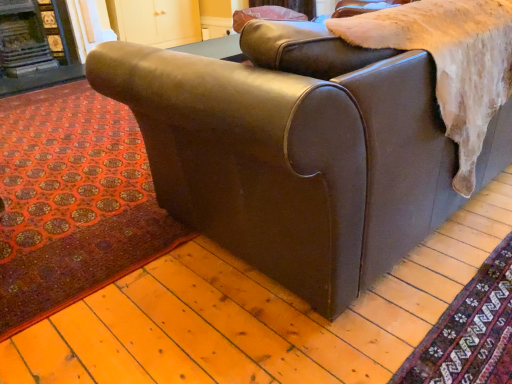
The height and width of the screenshot is (384, 512). Describe the element at coordinates (293, 154) in the screenshot. I see `matte brown leather couch at center` at that location.

The image size is (512, 384). What do you see at coordinates (470, 332) in the screenshot? I see `carpeted floor at lower right, arranged as the second mat when viewed from the back` at bounding box center [470, 332].

Where is `red carpet at lower left, the second mat from the right`? The width and height of the screenshot is (512, 384). red carpet at lower left, the second mat from the right is located at coordinates (72, 201).

Where is `dark brown wood fireplace at upper left`? This screenshot has width=512, height=384. dark brown wood fireplace at upper left is located at coordinates (34, 47).

Visually, is matte brown leather couch at center positioned to the left or to the right of red carpet at lower left, the second mat from the right?

Based on their positions, matte brown leather couch at center is located to the right of red carpet at lower left, the second mat from the right.

Can you confirm if matte brown leather couch at center is smaller than red carpet at lower left, which is counted as the second mat, starting from the front?

No.

Considering the points (325, 208) and (99, 100), which point is behind, point (325, 208) or point (99, 100)?

The point (99, 100) is more distant.

Is matte brown leather couch at center completely or partially inside carpeted floor at lower right, arranged as the second mat when viewed from the back?

Actually, matte brown leather couch at center is outside carpeted floor at lower right, arranged as the second mat when viewed from the back.

Which of these two, carpeted floor at lower right, which is counted as the 2th mat, starting from the left, or matte brown leather couch at center, is thinner?

carpeted floor at lower right, which is counted as the 2th mat, starting from the left.

Is point (501, 324) positioned behind point (370, 50)?

Yes, it is.

How many degrees apart are the facing directions of carpeted floor at lower right, arranged as the second mat when viewed from the back, and matte brown leather couch at center?

carpeted floor at lower right, arranged as the second mat when viewed from the back, and matte brown leather couch at center are facing 91.4 degrees away from each other.

From a real-world perspective, is carpeted floor at lower right, arranged as the first mat when viewed from the front, positioned above or below dark brown wood fireplace at upper left?

Clearly, from a real-world perspective, carpeted floor at lower right, arranged as the first mat when viewed from the front, is below dark brown wood fireplace at upper left.

Which object is more forward, carpeted floor at lower right, which ranks as the first mat in right-to-left order, or dark brown wood fireplace at upper left?

carpeted floor at lower right, which ranks as the first mat in right-to-left order.

How different are the orientations of carpeted floor at lower right, arranged as the first mat when viewed from the front, and dark brown wood fireplace at upper left in degrees?

They differ by 88.8 degrees in their facing directions.

Could you tell me if matte brown leather couch at center is turned towards matte pink pillow at upper center?

Yes, matte brown leather couch at center is oriented towards matte pink pillow at upper center.

What's the angular difference between matte brown leather couch at center and matte pink pillow at upper center's facing directions?

There is a 87.5-degree angle between the facing directions of matte brown leather couch at center and matte pink pillow at upper center.

Is point (158, 146) less distant than point (292, 17)?

Yes, it is.

Is matte brown leather couch at center positioned beyond the bounds of matte pink pillow at upper center?

matte brown leather couch at center is positioned outside matte pink pillow at upper center.

Which of these two, matte pink pillow at upper center or carpeted floor at lower right, arranged as the first mat when viewed from the front, stands taller?

matte pink pillow at upper center is taller.

Which object is closer to the camera, matte pink pillow at upper center or carpeted floor at lower right, which is counted as the 2th mat, starting from the left?

Positioned in front is carpeted floor at lower right, which is counted as the 2th mat, starting from the left.

Considering the relative sizes of matte pink pillow at upper center and carpeted floor at lower right, which is counted as the 2th mat, starting from the left, in the image provided, is matte pink pillow at upper center thinner than carpeted floor at lower right, which is counted as the 2th mat, starting from the left,?

Correct, the width of matte pink pillow at upper center is less than that of carpeted floor at lower right, which is counted as the 2th mat, starting from the left.

Choose the correct answer: Is matte pink pillow at upper center inside carpeted floor at lower right, which ranks as the first mat in right-to-left order, or outside it?

matte pink pillow at upper center exists outside the volume of carpeted floor at lower right, which ranks as the first mat in right-to-left order.

Is dark brown wood fireplace at upper left shorter than red carpet at lower left, which ranks as the 1th mat in back-to-front order?

No, dark brown wood fireplace at upper left is not shorter than red carpet at lower left, which ranks as the 1th mat in back-to-front order.

Which object is further away from the camera taking this photo, dark brown wood fireplace at upper left or red carpet at lower left, the second mat from the right?

dark brown wood fireplace at upper left.

From a real-world perspective, is dark brown wood fireplace at upper left below red carpet at lower left, the second mat from the right?

No.

Are dark brown wood fireplace at upper left and red carpet at lower left, acting as the 1th mat starting from the left, located far from each other?

dark brown wood fireplace at upper left is far away from red carpet at lower left, acting as the 1th mat starting from the left.

Is matte pink pillow at upper center wider than dark brown wood fireplace at upper left?

Correct, the width of matte pink pillow at upper center exceeds that of dark brown wood fireplace at upper left.

Is matte pink pillow at upper center completely or partially outside of dark brown wood fireplace at upper left?

Indeed, matte pink pillow at upper center is completely outside dark brown wood fireplace at upper left.

From the image's perspective, would you say matte pink pillow at upper center is positioned over dark brown wood fireplace at upper left?

Yes, from the image's perspective, matte pink pillow at upper center is on top of dark brown wood fireplace at upper left.

Based on the photo, considering the sizes of matte pink pillow at upper center and dark brown wood fireplace at upper left in the image, is matte pink pillow at upper center taller or shorter than dark brown wood fireplace at upper left?

Clearly, matte pink pillow at upper center is shorter compared to dark brown wood fireplace at upper left.

There is a matte brown leather couch at center. Where is `the 1st mat below it (from the image's perspective)`? The height and width of the screenshot is (384, 512). the 1st mat below it (from the image's perspective) is located at coordinates (72, 201).

In the image, there is a carpeted floor at lower right, which ranks as the first mat in right-to-left order. Where is `studio couch above it (from the image's perspective)`? This screenshot has height=384, width=512. studio couch above it (from the image's perspective) is located at coordinates (293, 154).

Looking at the image, which one is located closer to carpeted floor at lower right, arranged as the second mat when viewed from the back, dark brown wood fireplace at upper left or matte pink pillow at upper center?

matte pink pillow at upper center lies closer to carpeted floor at lower right, arranged as the second mat when viewed from the back, than the other object.

Looking at the image, which one is located further to carpeted floor at lower right, arranged as the first mat when viewed from the front, matte pink pillow at upper center or matte brown leather couch at center?

matte pink pillow at upper center is positioned further to the anchor carpeted floor at lower right, arranged as the first mat when viewed from the front.

Estimate the real-world distances between objects in this image. Which object is further from red carpet at lower left, the second mat from the right, carpeted floor at lower right, which ranks as the first mat in right-to-left order, or dark brown wood fireplace at upper left?

Among the two, dark brown wood fireplace at upper left is located further to red carpet at lower left, the second mat from the right.

From the picture: Looking at the image, which one is located closer to carpeted floor at lower right, which is counted as the 2th mat, starting from the left, dark brown wood fireplace at upper left or matte brown leather couch at center?

matte brown leather couch at center.

When comparing their distances from matte pink pillow at upper center, does carpeted floor at lower right, arranged as the first mat when viewed from the front, or dark brown wood fireplace at upper left seem further?

carpeted floor at lower right, arranged as the first mat when viewed from the front, is further to matte pink pillow at upper center.

Based on their spatial positions, is red carpet at lower left, the second mat from the right, or matte pink pillow at upper center closer to dark brown wood fireplace at upper left?

red carpet at lower left, the second mat from the right.

When comparing their distances from matte brown leather couch at center, does red carpet at lower left, which is counted as the second mat, starting from the front, or matte pink pillow at upper center seem closer?

red carpet at lower left, which is counted as the second mat, starting from the front, lies closer to matte brown leather couch at center than the other object.

When comparing their distances from carpeted floor at lower right, arranged as the first mat when viewed from the front, does dark brown wood fireplace at upper left or red carpet at lower left, the second mat from the right, seem closer?

red carpet at lower left, the second mat from the right.

The height and width of the screenshot is (384, 512). What are the coordinates of `studio couch between red carpet at lower left, the second mat from the right, and carpeted floor at lower right, arranged as the first mat when viewed from the front` in the screenshot? It's located at (293, 154).

Where is `studio couch between dark brown wood fireplace at upper left and carpeted floor at lower right, which ranks as the first mat in right-to-left order, in the horizontal direction`? This screenshot has height=384, width=512. studio couch between dark brown wood fireplace at upper left and carpeted floor at lower right, which ranks as the first mat in right-to-left order, in the horizontal direction is located at coordinates (293, 154).

Find the location of a particular element. The image size is (512, 384). fireplace between red carpet at lower left, the second mat from the right, and matte pink pillow at upper center, along the z-axis is located at coordinates point(34,47).

Find the location of a particular element. This screenshot has width=512, height=384. fireplace between matte brown leather couch at center and matte pink pillow at upper center in the front-back direction is located at coordinates (34, 47).